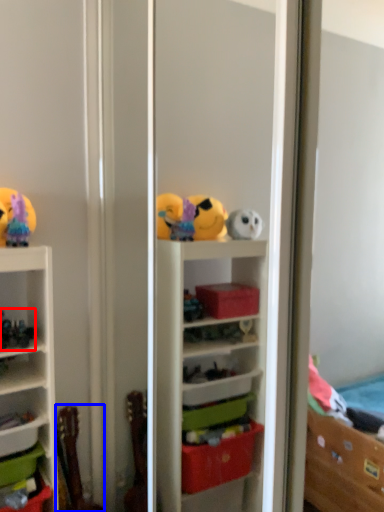
Question: Which point is further to the camera, toy (highlighted by a red box) or toy (highlighted by a blue box)?

Choices:
 (A) toy
 (B) toy

Answer: (B)